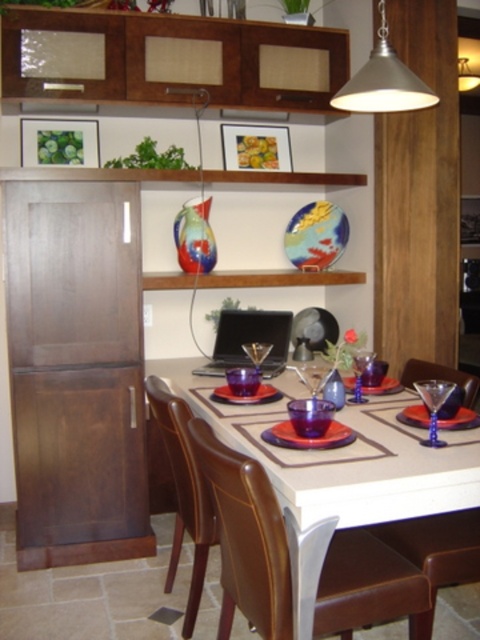
Does brown leather chair at center appear on the left side of translucent purple plate at table center?

Correct, you'll find brown leather chair at center to the left of translucent purple plate at table center.

Describe the element at coordinates (183, 492) in the screenshot. Image resolution: width=480 pixels, height=640 pixels. I see `brown leather chair at center` at that location.

Find the location of a particular element. This screenshot has width=480, height=640. brown leather chair at center is located at coordinates (183, 492).

Is brown leather chair at center smaller than transparent blue martini glass at table center?

Actually, brown leather chair at center might be larger than transparent blue martini glass at table center.

Is point (186, 483) more distant than point (440, 444)?

Yes.

You are a GUI agent. You are given a task and a screenshot of the screen. Output one action in this format:
    pyautogui.click(x=<x>, y=<y>)
    Task: Click on the brown leather chair at center
    
    Given the screenshot: What is the action you would take?
    pyautogui.click(x=183, y=492)

Is white glossy table at center to the left of transparent blue wine glass at table center from the viewer's perspective?

Indeed, white glossy table at center is positioned on the left side of transparent blue wine glass at table center.

Is white glossy table at center closer to the viewer compared to transparent blue wine glass at table center?

Yes.

You are a GUI agent. You are given a task and a screenshot of the screen. Output one action in this format:
    pyautogui.click(x=<x>, y=<y>)
    Task: Click on the white glossy table at center
    
    Given the screenshot: What is the action you would take?
    pyautogui.click(x=339, y=472)